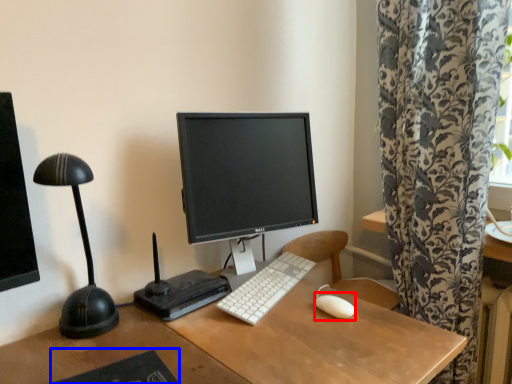
Question: Which point is further to the camera, mouse (highlighted by a red box) or mousepad (highlighted by a blue box)?

Choices:
 (A) mouse
 (B) mousepad

Answer: (A)